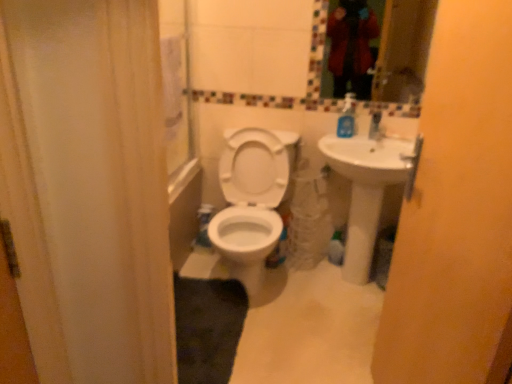
Locate an element on the screen. matte yellow screen door at right is located at coordinates (456, 213).

What is the approximate width of matte yellow screen door at right?

It is 5.11 inches.

What do you see at coordinates (251, 201) in the screenshot? I see `white glossy toilet at center` at bounding box center [251, 201].

At what (x,y) coordinates should I click in order to perform the action: click on white glossy sink at right. Please return your answer as a coordinate pair (x, y). Looking at the image, I should click on (365, 191).

What do you see at coordinates (403, 44) in the screenshot? This screenshot has width=512, height=384. I see `glassy mosaic mirror at upper center` at bounding box center [403, 44].

At what (x,y) coordinates should I click in order to perform the action: click on matte yellow screen door at right. Please return your answer as a coordinate pair (x, y). This screenshot has width=512, height=384. Looking at the image, I should click on click(x=456, y=213).

Is matte yellow screen door at right facing towards blue plastic soap dispenser at upper right?

No.

From a real-world perspective, who is located lower, matte yellow screen door at right or blue plastic soap dispenser at upper right?

In real-world perspective, matte yellow screen door at right is lower.

From the image's perspective, is matte yellow screen door at right located above blue plastic soap dispenser at upper right?

No, from the image's perspective, matte yellow screen door at right is not on top of blue plastic soap dispenser at upper right.

Would you say blue plastic soap dispenser at upper right is part of matte yellow screen door at right's contents?

Definitely not — blue plastic soap dispenser at upper right is not inside matte yellow screen door at right.

Is white glossy sink at right to the left of blue plastic soap dispenser at upper right from the viewer's perspective?

Incorrect, white glossy sink at right is not on the left side of blue plastic soap dispenser at upper right.

Is white glossy sink at right outside of blue plastic soap dispenser at upper right?

Yes, white glossy sink at right is not within blue plastic soap dispenser at upper right.

Does white glossy sink at right have a greater height compared to blue plastic soap dispenser at upper right?

Correct, white glossy sink at right is much taller as blue plastic soap dispenser at upper right.

Does white glossy sink at right come behind blue plastic soap dispenser at upper right?

No, the depth of white glossy sink at right is less than that of blue plastic soap dispenser at upper right.

Is matte yellow screen door at right positioned far away from white glossy toilet at center?

No.

From a real-world perspective, is matte yellow screen door at right positioned above or below white glossy toilet at center?

matte yellow screen door at right is above white glossy toilet at center.

Can we say glassy mosaic mirror at upper center lies outside matte yellow screen door at right?

Indeed, glassy mosaic mirror at upper center is completely outside matte yellow screen door at right.

Considering the relative sizes of glassy mosaic mirror at upper center and matte yellow screen door at right in the image provided, is glassy mosaic mirror at upper center shorter than matte yellow screen door at right?

Yes, glassy mosaic mirror at upper center is shorter than matte yellow screen door at right.

Which of these two, glassy mosaic mirror at upper center or matte yellow screen door at right, is smaller?

glassy mosaic mirror at upper center.

Is white glossy sink at right bigger than white glossy toilet at center?

Incorrect, white glossy sink at right is not larger than white glossy toilet at center.

The height and width of the screenshot is (384, 512). What are the coordinates of `sink lying above the white glossy toilet at center (from the image's perspective)` in the screenshot? It's located at (365, 191).

Who is shorter, white glossy sink at right or white glossy toilet at center?

white glossy toilet at center.

Do you think white glossy sink at right is within white glossy toilet at center, or outside of it?

white glossy sink at right cannot be found inside white glossy toilet at center.

From a real-world perspective, is blue plastic soap dispenser at upper right on top of matte yellow screen door at right?

Yes.

This screenshot has height=384, width=512. I want to click on soap dispenser to the right of matte yellow screen door at right, so click(347, 117).

From the image's perspective, which is above, blue plastic soap dispenser at upper right or matte yellow screen door at right?

blue plastic soap dispenser at upper right.

Measure the distance from blue plastic soap dispenser at upper right to matte yellow screen door at right.

blue plastic soap dispenser at upper right is 1.16 meters from matte yellow screen door at right.

From a real-world perspective, is white glossy sink at right physically located above or below matte yellow screen door at right?

white glossy sink at right is below matte yellow screen door at right.

Are white glossy sink at right and matte yellow screen door at right far apart?

Actually, white glossy sink at right and matte yellow screen door at right are a little close together.

How many degrees apart are the facing directions of white glossy sink at right and matte yellow screen door at right?

The facing directions of white glossy sink at right and matte yellow screen door at right are 80.7 degrees apart.

Find the location of `sink on the right side of matte yellow screen door at right`. sink on the right side of matte yellow screen door at right is located at coordinates (365, 191).

At what (x,y) coordinates should I click in order to perform the action: click on soap dispenser above the matte yellow screen door at right (from a real-world perspective). Please return your answer as a coordinate pair (x, y). The width and height of the screenshot is (512, 384). Looking at the image, I should click on (347, 117).

What are the coordinates of `sink below the blue plastic soap dispenser at upper right (from the image's perspective)` in the screenshot? It's located at (365, 191).

From the image, which object appears to be farther from matte yellow screen door at right, blue plastic soap dispenser at upper right or white glossy toilet at center?

Among the two, blue plastic soap dispenser at upper right is located further to matte yellow screen door at right.

Consider the image. Based on their spatial positions, is glassy mosaic mirror at upper center or white glossy sink at right further from matte yellow screen door at right?

glassy mosaic mirror at upper center is positioned further to the anchor matte yellow screen door at right.

Which object lies nearer to the anchor point white glossy sink at right, blue plastic soap dispenser at upper right or matte yellow screen door at right?

The object closer to white glossy sink at right is blue plastic soap dispenser at upper right.

Which object lies further to the anchor point white glossy toilet at center, blue plastic soap dispenser at upper right or glassy mosaic mirror at upper center?

Based on the image, glassy mosaic mirror at upper center appears to be further to white glossy toilet at center.

Based on their spatial positions, is white glossy toilet at center or matte yellow screen door at right closer to blue plastic soap dispenser at upper right?

white glossy toilet at center lies closer to blue plastic soap dispenser at upper right than the other object.

Which object lies nearer to the anchor point white glossy sink at right, blue plastic soap dispenser at upper right or glassy mosaic mirror at upper center?

Among the two, blue plastic soap dispenser at upper right is located nearer to white glossy sink at right.

Looking at the image, which one is located further to glassy mosaic mirror at upper center, white glossy toilet at center or blue plastic soap dispenser at upper right?

white glossy toilet at center lies further to glassy mosaic mirror at upper center than the other object.

Which object lies nearer to the anchor point white glossy toilet at center, glassy mosaic mirror at upper center or matte yellow screen door at right?

Based on the image, matte yellow screen door at right appears to be nearer to white glossy toilet at center.

Where is `mirror between matte yellow screen door at right and blue plastic soap dispenser at upper right in the front-back direction`? mirror between matte yellow screen door at right and blue plastic soap dispenser at upper right in the front-back direction is located at coordinates (403, 44).

In order to click on toilet located between matte yellow screen door at right and blue plastic soap dispenser at upper right in the depth direction in this screenshot , I will do `click(251, 201)`.

Identify the location of sink between matte yellow screen door at right and glassy mosaic mirror at upper center in the front-back direction. This screenshot has height=384, width=512. (365, 191).

Where is `soap dispenser situated between white glossy toilet at center and white glossy sink at right from left to right`? soap dispenser situated between white glossy toilet at center and white glossy sink at right from left to right is located at coordinates (347, 117).